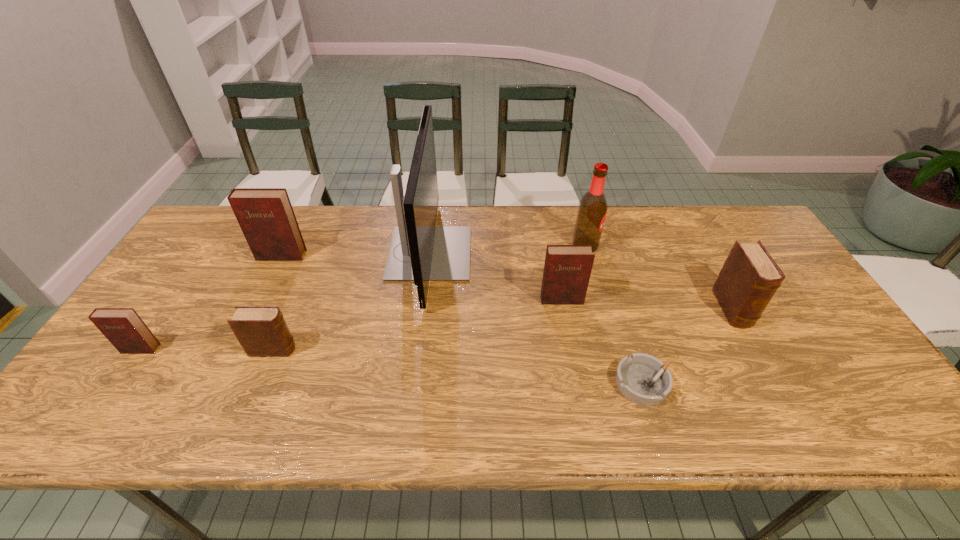
Where is `free space located 0.390m on the spine side of the smaller brown diary`? free space located 0.390m on the spine side of the smaller brown diary is located at coordinates (453, 349).

Find the location of a particular element. free region located on the front cover of the smallest reddish-brown diary is located at coordinates (118, 382).

Identify the location of vacant space located on the right of the ashtray. Image resolution: width=960 pixels, height=540 pixels. (796, 383).

This screenshot has width=960, height=540. Identify the location of computer monitor that is at the far edge. (420, 251).

Where is `beer bottle present at the far edge`? beer bottle present at the far edge is located at coordinates (592, 209).

Image resolution: width=960 pixels, height=540 pixels. What are the coordinates of `diary that is at the far edge` in the screenshot? It's located at (265, 215).

Where is `object that is positioned at the near edge`? object that is positioned at the near edge is located at coordinates (643, 379).

Where is `object located in the left edge section of the desktop`? This screenshot has width=960, height=540. object located in the left edge section of the desktop is located at coordinates (123, 327).

In the image, there is a desktop. Where is `vacant space at the far edge`? This screenshot has width=960, height=540. vacant space at the far edge is located at coordinates (347, 222).

This screenshot has height=540, width=960. In the image, there is a desktop. In order to click on blank space at the near edge in this screenshot , I will do `click(438, 420)`.